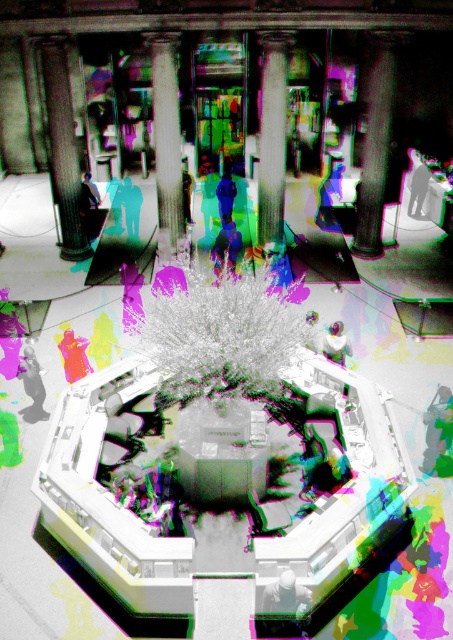
Question: Which of the following is the farthest from the observer?

Choices:
 (A) (154, 84)
 (B) (283, 93)
 (C) (64, 112)

Answer: (C)

Question: Which point appears farthest from the camera in this image?

Choices:
 (A) (258, 369)
 (B) (357, 205)
 (C) (174, 230)
 (D) (53, 164)

Answer: (B)

Question: Is smooth white pillar at center to the right of white glossy pillar at center from the viewer's perspective?

Choices:
 (A) no
 (B) yes

Answer: (A)

Question: Among these objects, which one is farthest from the camera?

Choices:
 (A) white fluffy tree at center
 (B) smooth gray column at right
 (C) white glossy pillar at center
 (D) smooth gray column at upper left

Answer: (B)

Question: Is smooth gray column at right to the left of smooth white pillar at center from the viewer's perspective?

Choices:
 (A) yes
 (B) no

Answer: (B)

Question: Considering the relative positions of smooth gray column at right and smooth white pillar at center in the image provided, where is smooth gray column at right located with respect to smooth white pillar at center?

Choices:
 (A) above
 (B) below

Answer: (B)